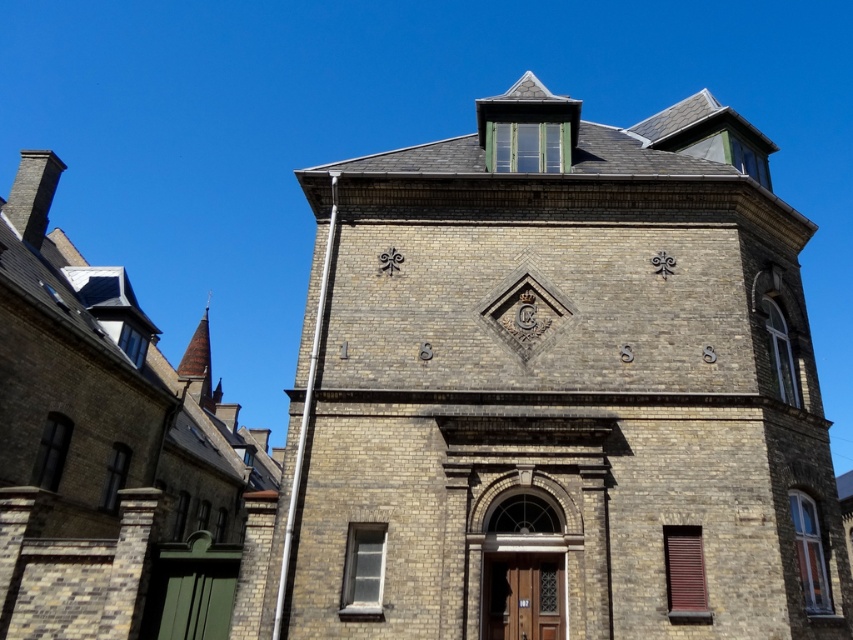
Question: Can you confirm if brown brick tower at center is positioned below brown brick church at left?

Choices:
 (A) yes
 (B) no

Answer: (B)

Question: Can you confirm if brown brick tower at center is positioned below smooth copper spire at upper left?

Choices:
 (A) no
 (B) yes

Answer: (A)

Question: Where is brown brick tower at center located in relation to smooth copper spire at upper left in the image?

Choices:
 (A) left
 (B) right

Answer: (B)

Question: Which is nearer to the brown brick church at left?

Choices:
 (A) smooth copper spire at upper left
 (B) brown brick tower at center

Answer: (A)

Question: Which object appears farthest from the camera in this image?

Choices:
 (A) brown brick tower at center
 (B) brown brick church at left
 (C) smooth copper spire at upper left

Answer: (C)

Question: Among these points, which one is farthest from the camera?

Choices:
 (A) (202, 380)
 (B) (775, 548)
 (C) (15, 256)

Answer: (A)